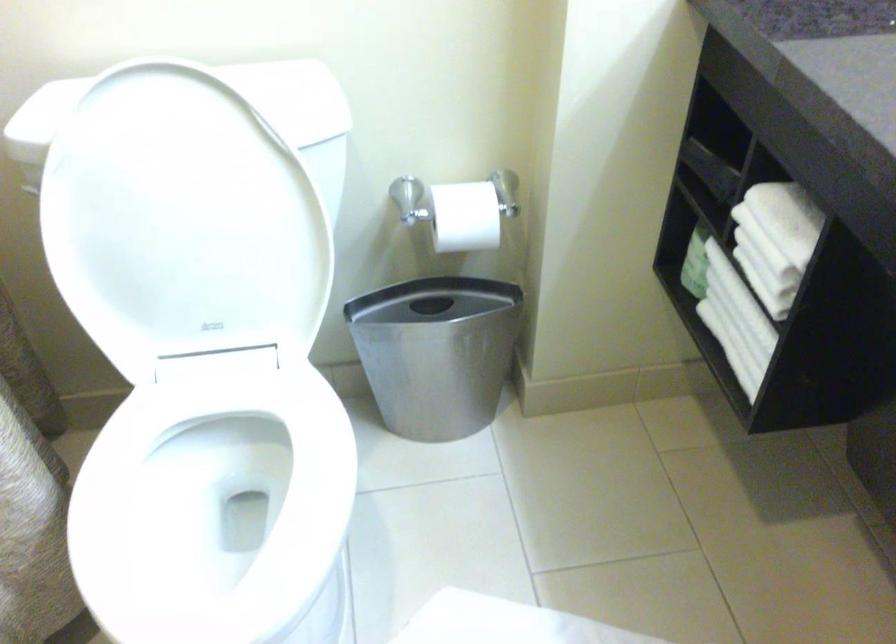
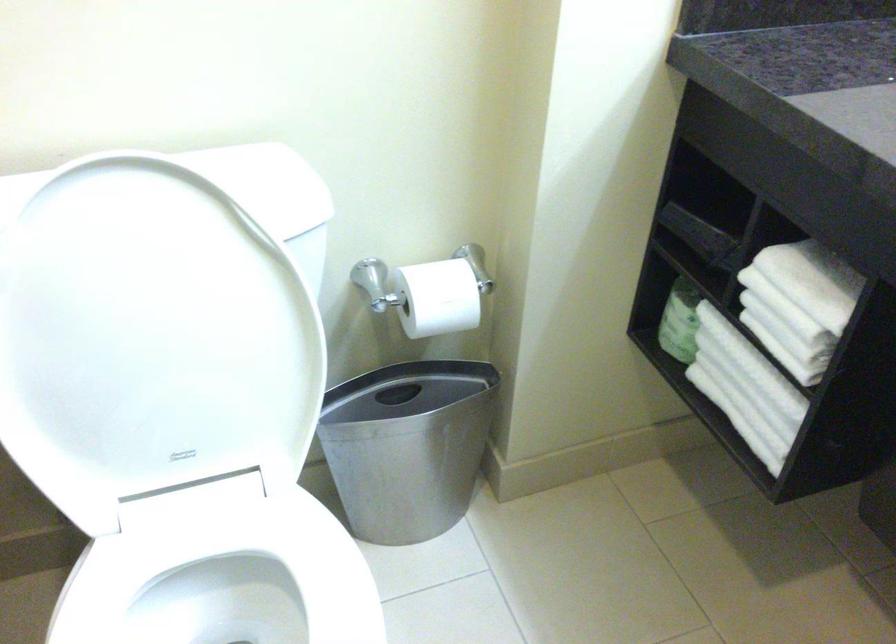
The point at (693,257) is marked in the first image. Where is the corresponding point in the second image?

(679, 321)